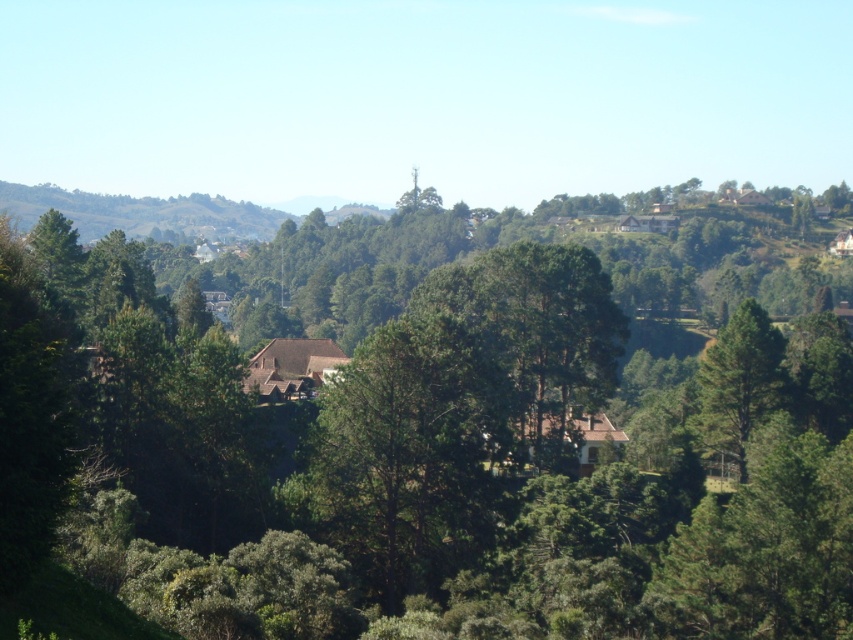
You are planning to plant a new tree in your backyard. You have two options from the image shown. The first is the green leafy tree at center, and the second is the green matte tree at center. Based on their widths, which tree would require more horizontal space for proper growth?

The green leafy tree at center might be wider than green matte tree at center, so it would likely require more horizontal space for proper growth.

You are standing at the origin point of the image. Which direction should you move to reach the green matte tree at center?

The green matte tree at center is located at coordinates point [404,456], so you should move towards the right and upward direction to reach it.